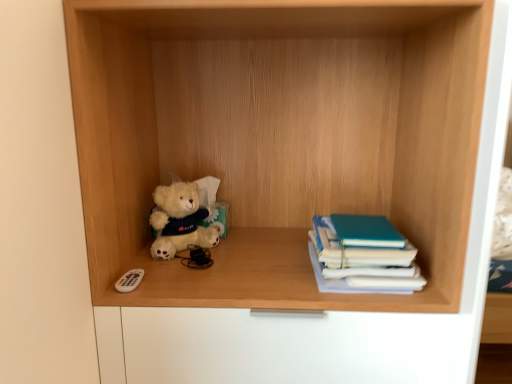
Question: Based on their sizes in the image, would you say fluffy white teddy bear at center-left is bigger or smaller than white plastic remote control at lower left?

Choices:
 (A) big
 (B) small

Answer: (A)

Question: Considering the positions of fluffy white teddy bear at center-left and white plastic remote control at lower left in the image, is fluffy white teddy bear at center-left taller or shorter than white plastic remote control at lower left?

Choices:
 (A) tall
 (B) short

Answer: (A)

Question: Which of these objects is positioned farthest from the fluffy white teddy bear at center-left?

Choices:
 (A) teal matte book at right
 (B) white plastic remote control at lower left
 (C) wooden shelf at center

Answer: (A)

Question: Which object is the farthest from the teal matte book at right?

Choices:
 (A) wooden shelf at center
 (B) white plastic remote control at lower left
 (C) fluffy white teddy bear at center-left

Answer: (B)